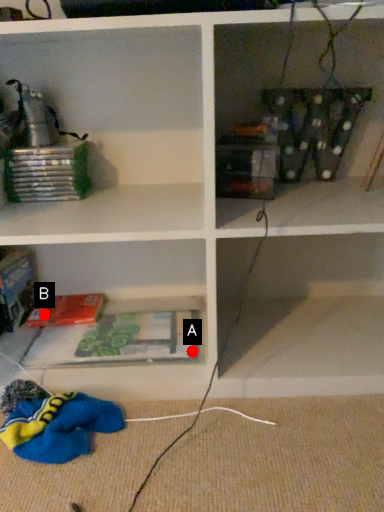
Question: Two points are circled on the image, labeled by A and B beside each circle. Which point is closer to the camera?

Choices:
 (A) A is closer
 (B) B is closer

Answer: (A)